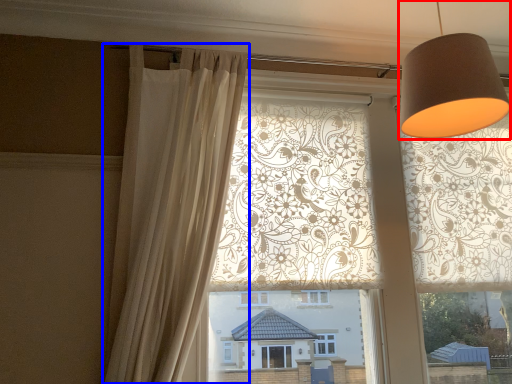
Question: Which object is closer to the camera taking this photo, table lamp (highlighted by a red box) or curtain (highlighted by a blue box)?

Choices:
 (A) table lamp
 (B) curtain

Answer: (A)